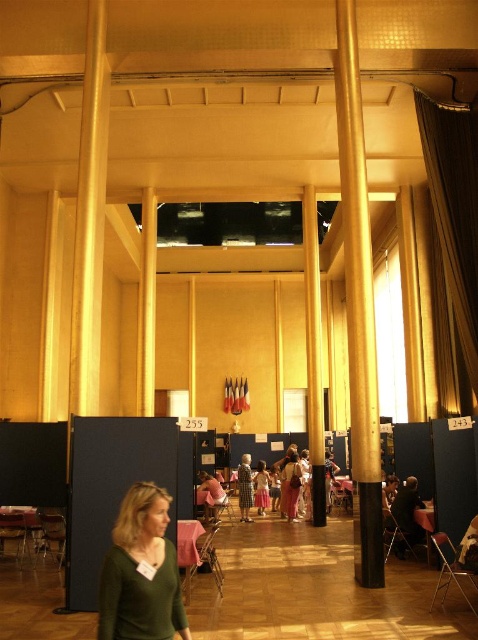
Can you confirm if gold polished metal pillar at center is positioned above pink fabric dress at center?

Yes.

Which is behind, point (344, 20) or point (252, 481)?

The point (252, 481) is behind.

What do you see at coordinates (358, 305) in the screenshot? The width and height of the screenshot is (478, 640). I see `gold polished metal pillar at center` at bounding box center [358, 305].

Locate an element on the screen. gold polished metal pillar at center is located at coordinates (358, 305).

Does point (347, 289) come behind point (219, 493)?

No, it is not.

Between gold polished metal pillar at center and matte pink shirt at center, which one is positioned higher?

Positioned higher is gold polished metal pillar at center.

Between point (373, 467) and point (209, 493), which one is positioned behind?

Point (209, 493)

You are a GUI agent. You are given a task and a screenshot of the screen. Output one action in this format:
    pyautogui.click(x=<x>, y=<y>)
    Task: Click on the gold polished metal pillar at center
    
    Given the screenshot: What is the action you would take?
    pyautogui.click(x=358, y=305)

Can you confirm if plaid fabric dress at center is bigger than pink fabric dress at center?

Indeed, plaid fabric dress at center has a larger size compared to pink fabric dress at center.

Which is in front, point (242, 483) or point (268, 483)?

Positioned in front is point (242, 483).

Measure the distance between point (249, 472) and camera.

The distance of point (249, 472) from camera is 15.02 meters.

Where is `plaid fabric dress at center`? plaid fabric dress at center is located at coordinates (245, 486).